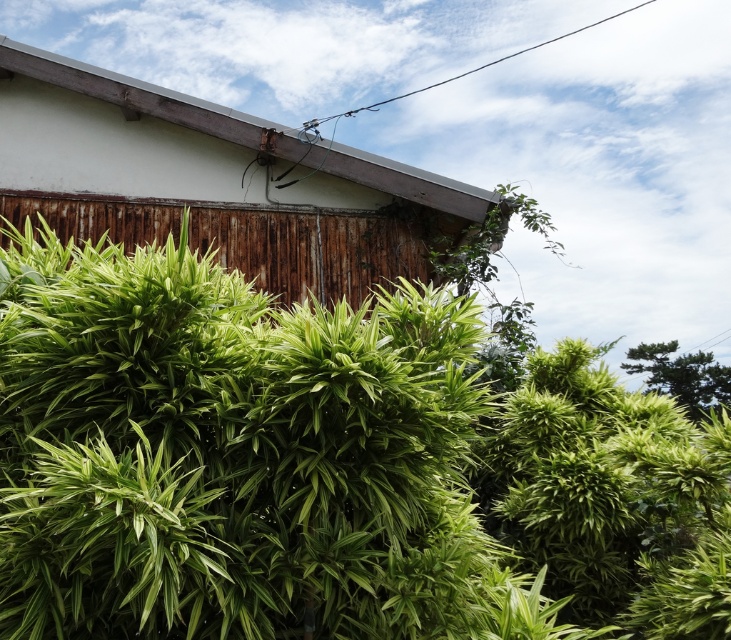
You are a gardener assessing the growth of plants in the scene. Which of the two plants, the green leafy plant at center or the green leafy tree at upper right, is taller?

The green leafy plant at center is taller than the green leafy tree at upper right.

You are a gardener looking at the building with a sloped roof. You see the green leafy plant at center and the green leafy tree at upper right. Which one would require more space in terms of size?

The green leafy plant at center is bigger than the green leafy tree at upper right, so it would require more space in terms of size.